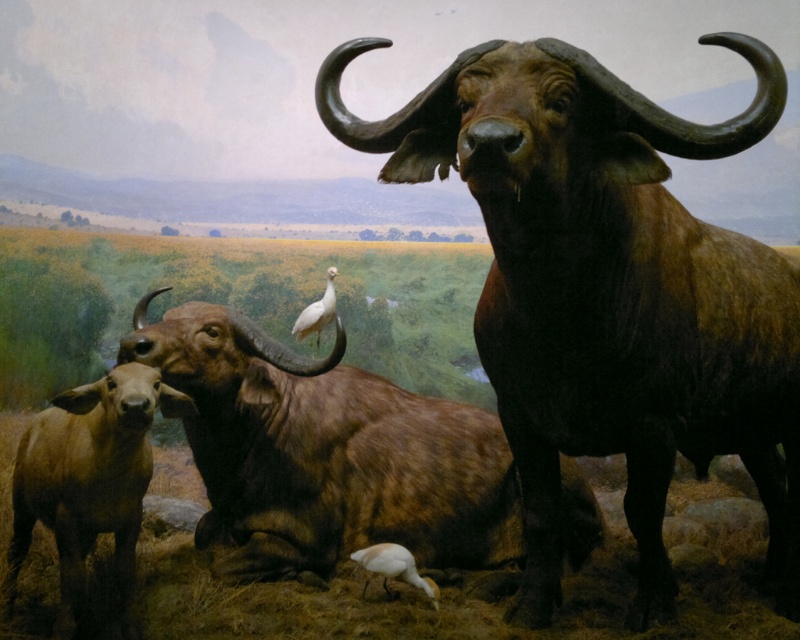
Is brown matte yak at center to the left of white matte bird at center from the viewer's perspective?

No, brown matte yak at center is not to the left of white matte bird at center.

Which of these two, brown matte yak at center or white matte bird at center, stands taller?

Standing taller between the two is brown matte yak at center.

Does point (448, 410) come in front of point (304, 324)?

Yes, it is in front of point (304, 324).

This screenshot has height=640, width=800. Identify the location of brown matte yak at center. (326, 452).

Can you confirm if shiny brown yak at center is thinner than white matte bird at lower center?

No.

Is shiny brown yak at center closer to the viewer compared to white matte bird at lower center?

That is True.

Between point (381, 138) and point (417, 573), which one is positioned behind?

Point (417, 573)

Where is `shiny brown yak at center`? shiny brown yak at center is located at coordinates (608, 289).

Which is above, shiny brown yak at center or white matte bird at center?

white matte bird at center is higher up.

Where is `shiny brown yak at center`? shiny brown yak at center is located at coordinates (608, 289).